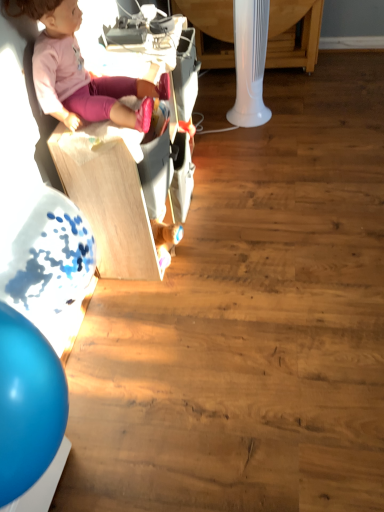
Identify the location of free space to the right of wooden toy box at upper left. The width and height of the screenshot is (384, 512). (279, 190).